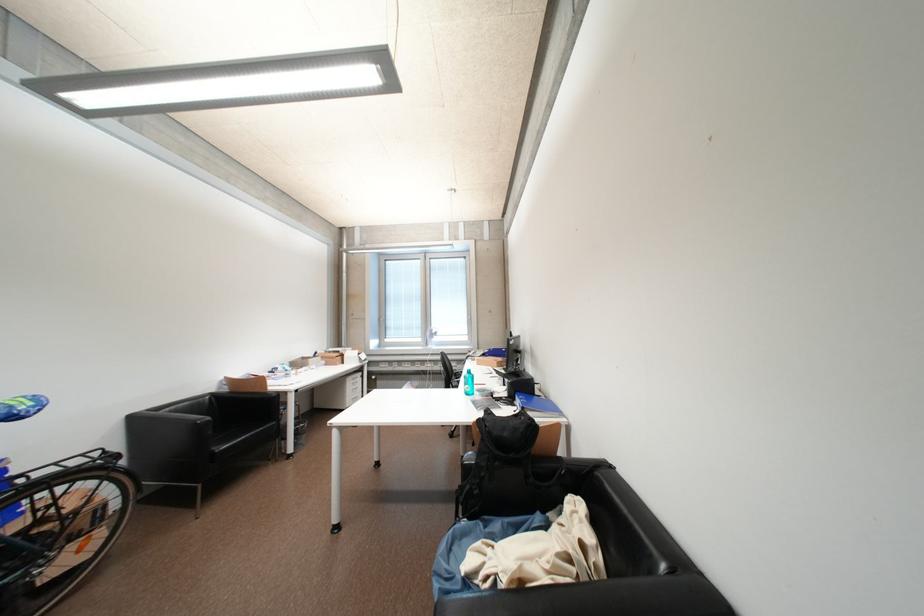
Where would you resting arm the chair armrest? Please return your answer as a coordinate pair (x, y).

(525, 474)